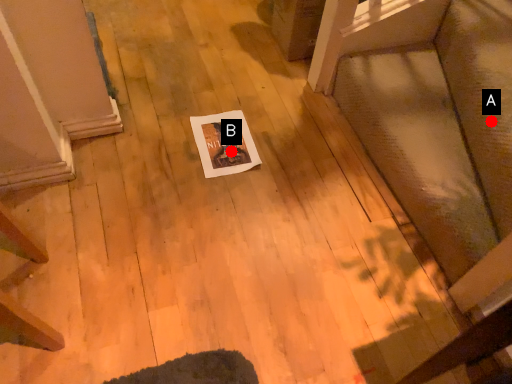
Question: Two points are circled on the image, labeled by A and B beside each circle. Which point is closer to the camera taking this photo?

Choices:
 (A) A is closer
 (B) B is closer

Answer: (A)